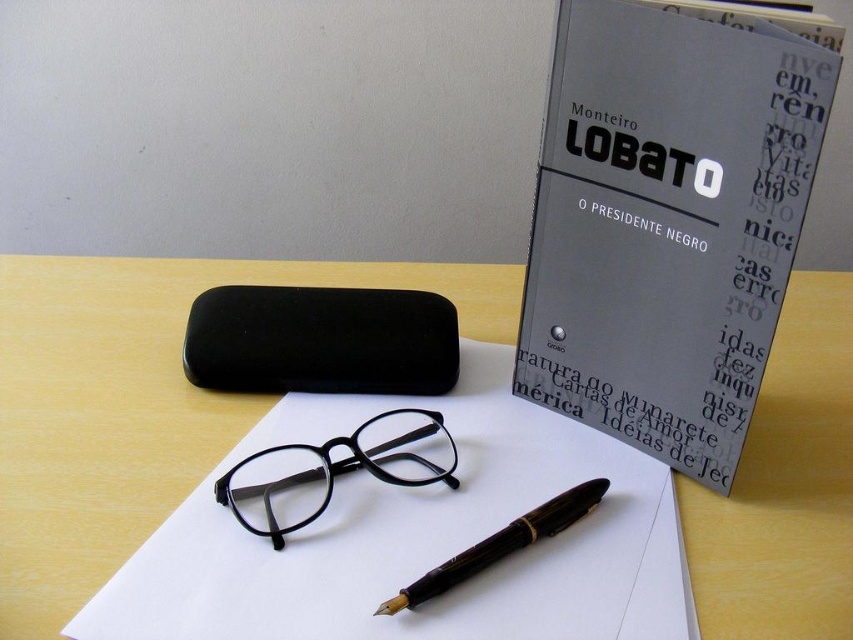
This screenshot has width=853, height=640. I want to click on black plastic glasses at center, so click(x=335, y=470).

Which is more to the left, black plastic glasses at center or brown wood fountain pen at center?

Positioned to the left is black plastic glasses at center.

At what (x,y) coordinates should I click in order to perform the action: click on black plastic glasses at center. Please return your answer as a coordinate pair (x, y). Looking at the image, I should click on (335, 470).

I want to click on black plastic glasses at center, so click(335, 470).

Who is positioned more to the left, wooden table at center or brown wood fountain pen at center?

Positioned to the left is wooden table at center.

Is wooden table at center shorter than brown wood fountain pen at center?

No, wooden table at center is not shorter than brown wood fountain pen at center.

Is point (796, 621) positioned after point (544, 506)?

No, (796, 621) is in front of (544, 506).

Locate an element on the screen. wooden table at center is located at coordinates (137, 404).

Based on the photo, can you confirm if matte gray book at upper right is bigger than brown wood fountain pen at center?

Correct, matte gray book at upper right is larger in size than brown wood fountain pen at center.

Who is lower down, matte gray book at upper right or brown wood fountain pen at center?

brown wood fountain pen at center is below.

At what (x,y) coordinates should I click in order to perform the action: click on matte gray book at upper right. Please return your answer as a coordinate pair (x, y). The width and height of the screenshot is (853, 640). Looking at the image, I should click on (666, 225).